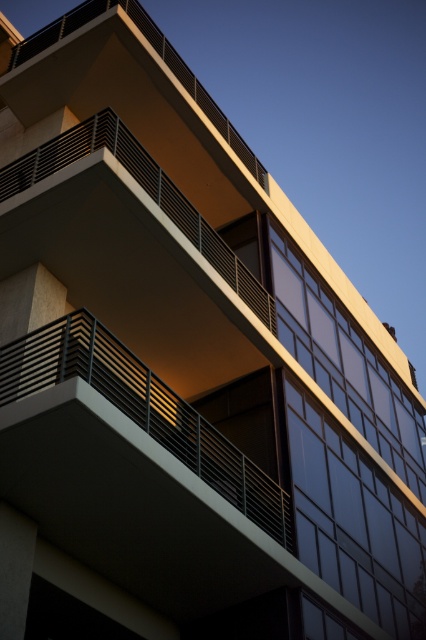
Based on the photo, which is above, metallic railings at center or matte black railing at upper center?

matte black railing at upper center is higher up.

This screenshot has height=640, width=426. I want to click on metallic railings at center, so click(x=143, y=410).

Between point (236, 502) and point (239, 292), which one is positioned in front?

Point (236, 502) is more forward.

You are a GUI agent. You are given a task and a screenshot of the screen. Output one action in this format:
    pyautogui.click(x=<x>, y=<y>)
    Task: Click on the metallic railings at center
    
    Given the screenshot: What is the action you would take?
    pyautogui.click(x=143, y=410)